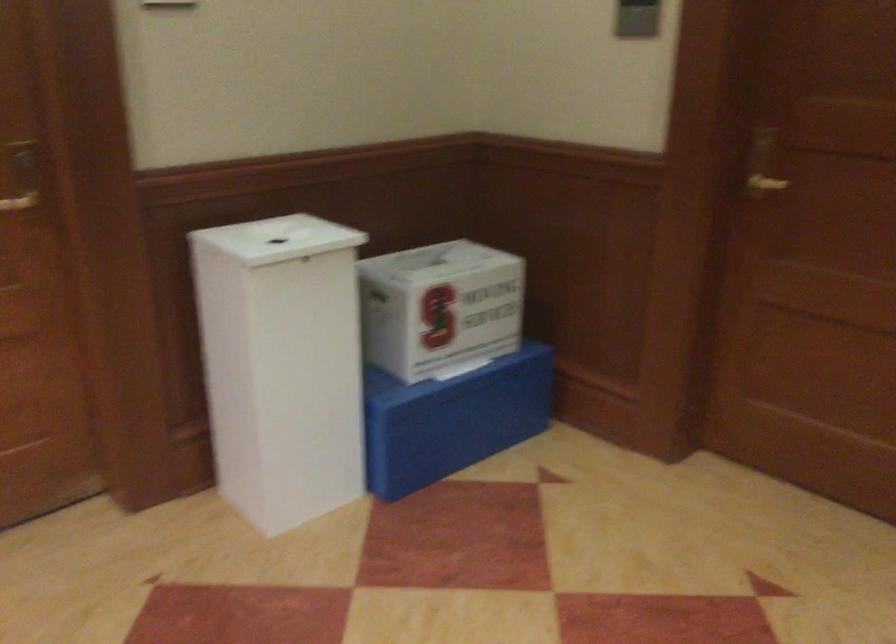
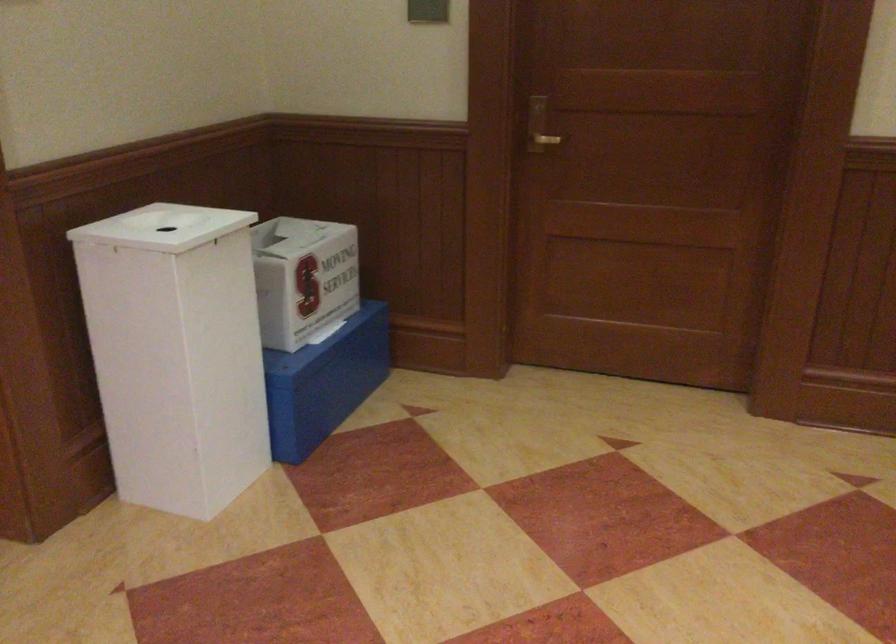
Question: How did the camera likely rotate?

Choices:
 (A) Left
 (B) Right
 (C) Up
 (D) Down

Answer: (B)